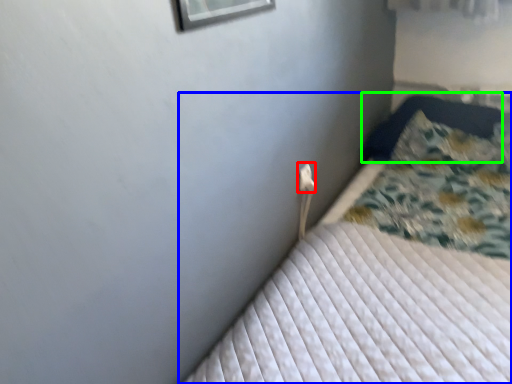
Question: Which object is positioned farthest from electric outlet (highlighted by a red box)? Select from bed (highlighted by a blue box) and pillow (highlighted by a green box).

Choices:
 (A) bed
 (B) pillow

Answer: (B)